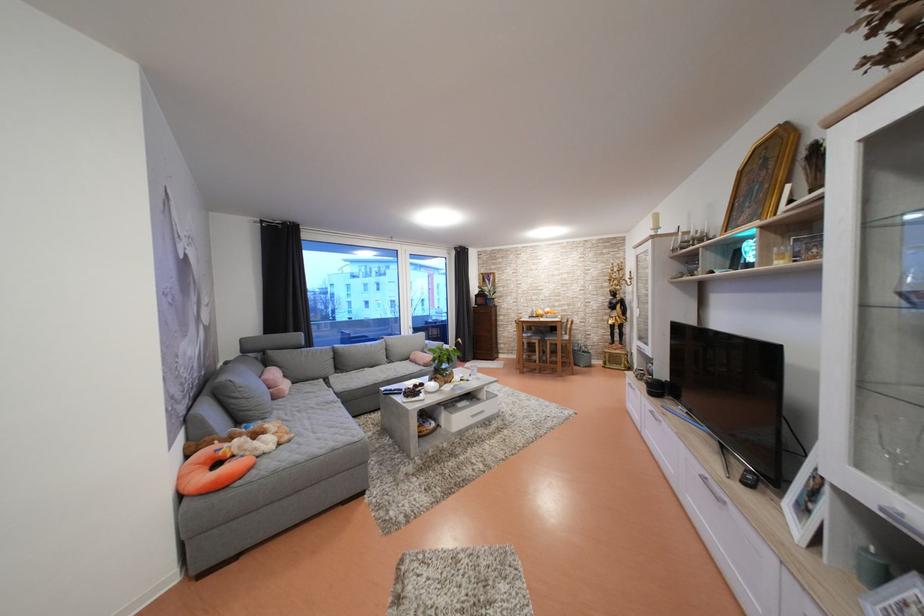
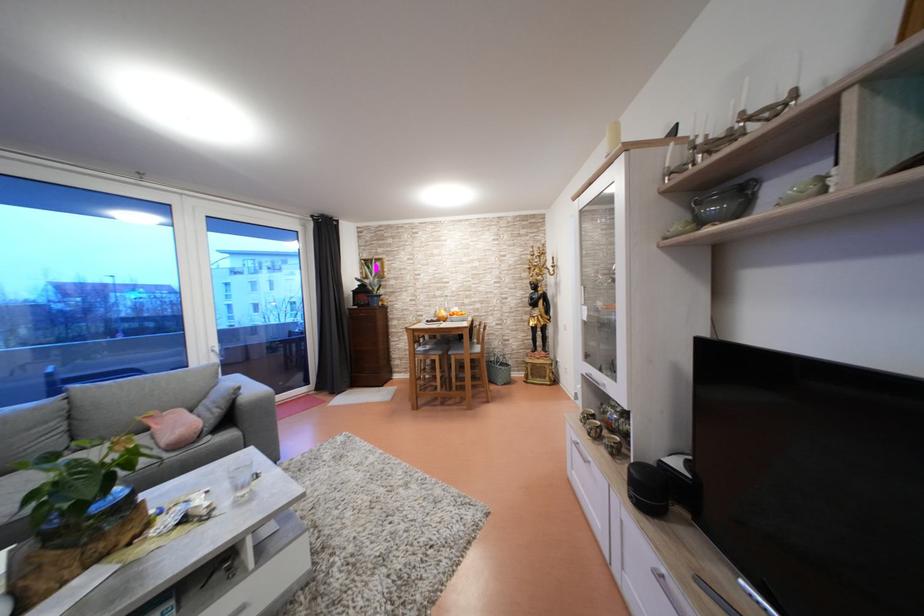
The point at (541, 302) is marked in the first image. Where is the corresponding point in the second image?

(444, 299)